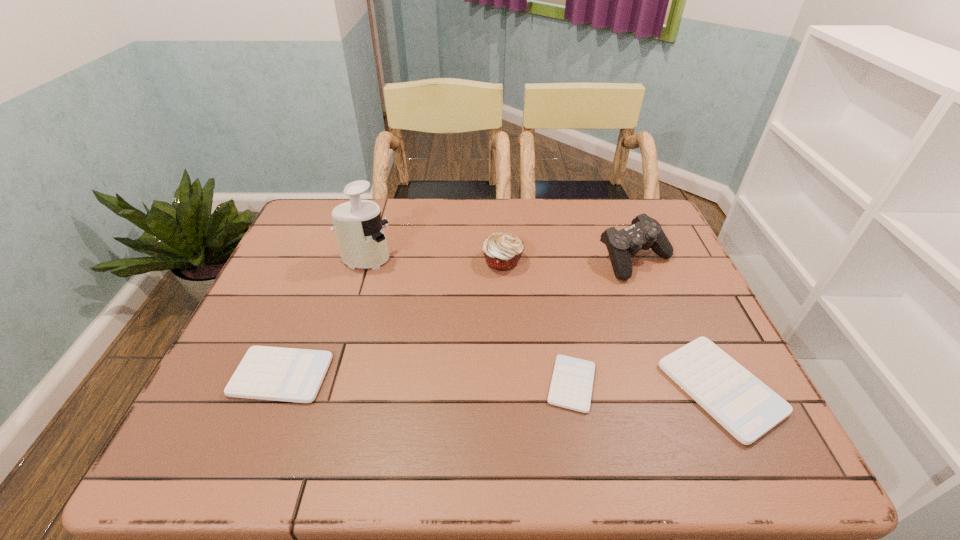
At what (x,y) coordinates should I click in order to perform the action: click on location for an additional calculator to make spacing equal. Please return your answer as a coordinate pair (x, y). The image size is (960, 540). Looking at the image, I should click on (425, 380).